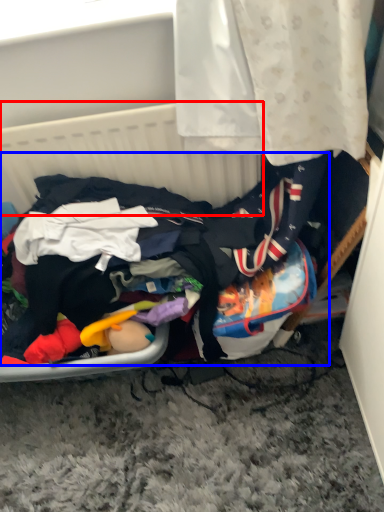
Question: Among these objects, which one is farthest to the camera, basket (highlighted by a red box) or clothing (highlighted by a blue box)?

Choices:
 (A) basket
 (B) clothing

Answer: (A)